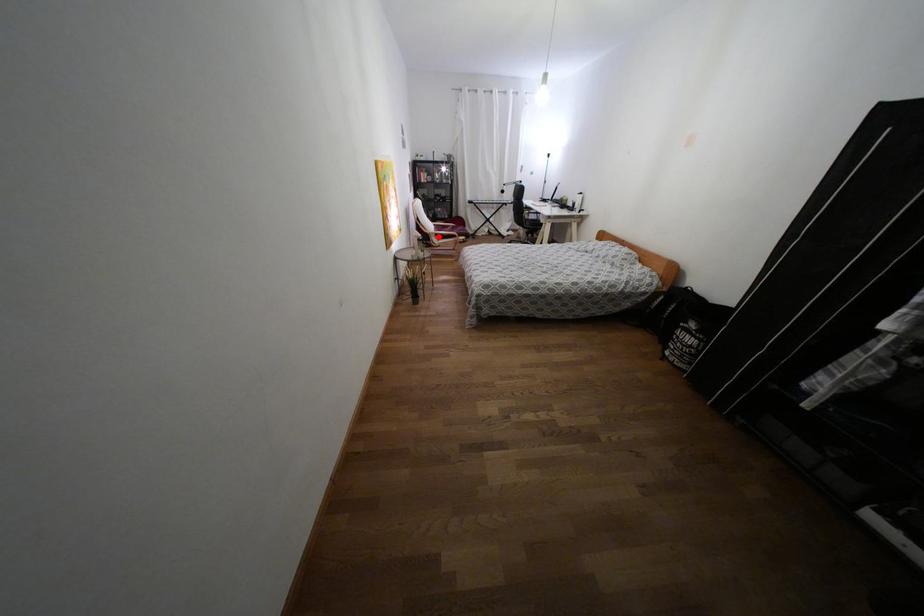
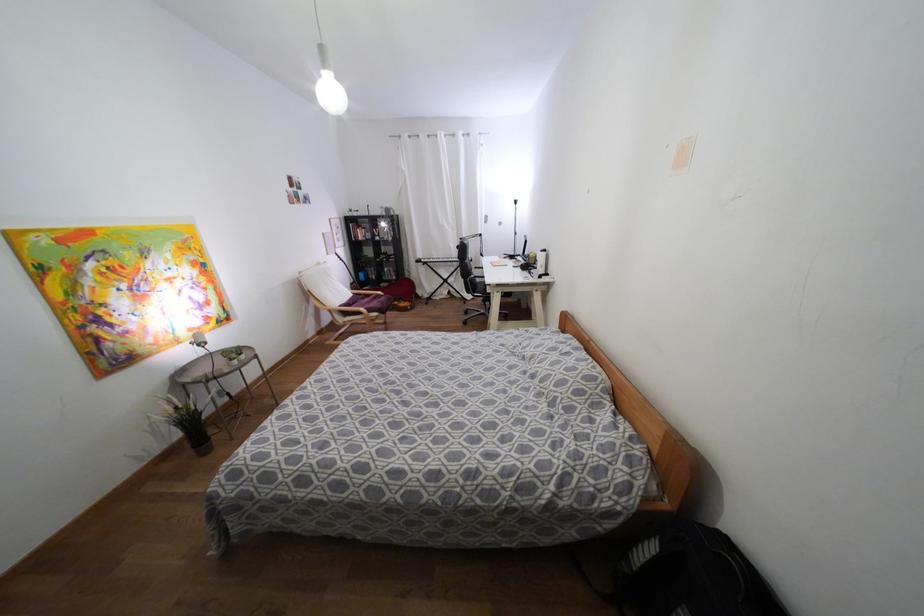
Find the pixel in the second image that matches the highlighted location in the first image.

(344, 313)